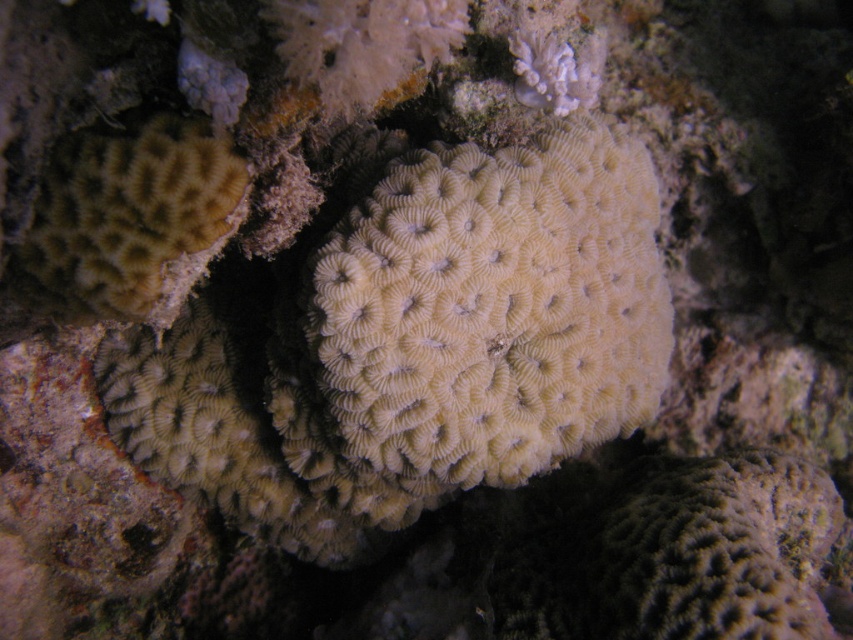
Between white matte coral at center and light brown textured coral at left, which one appears on the right side from the viewer's perspective?

Positioned to the right is white matte coral at center.

Is the position of white matte coral at center more distant than that of light brown textured coral at left?

Yes, white matte coral at center is behind light brown textured coral at left.

What do you see at coordinates (492, 307) in the screenshot? I see `white matte coral at center` at bounding box center [492, 307].

At what (x,y) coordinates should I click in order to perform the action: click on white matte coral at center. Please return your answer as a coordinate pair (x, y). Looking at the image, I should click on (492, 307).